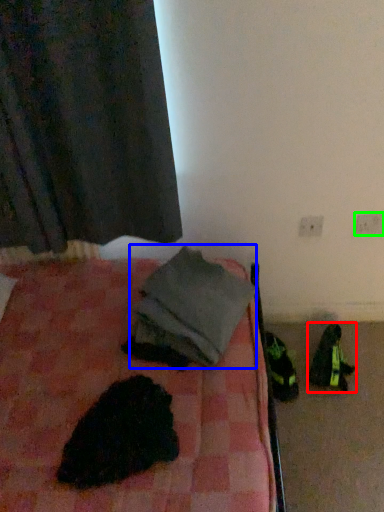
Question: Considering the real-world distances, which object is farthest from footwear (highlighted by a red box)? clothing (highlighted by a blue box) or electric outlet (highlighted by a green box)?

Choices:
 (A) clothing
 (B) electric outlet

Answer: (A)